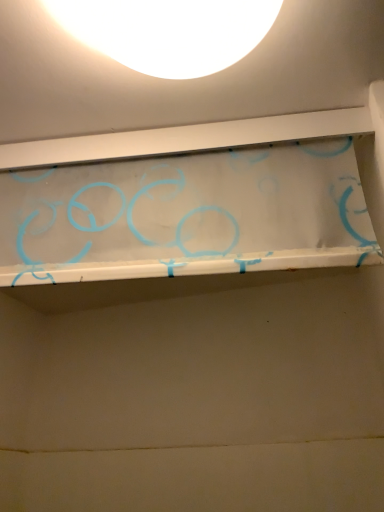
The height and width of the screenshot is (512, 384). What do you see at coordinates (168, 32) in the screenshot? I see `white matte lampshade at upper center` at bounding box center [168, 32].

I want to click on white matte lampshade at upper center, so tap(168, 32).

This screenshot has height=512, width=384. Identify the location of transparent plastic shelf at upper center. (198, 207).

Describe the element at coordinates (198, 207) in the screenshot. I see `transparent plastic shelf at upper center` at that location.

You are a GUI agent. You are given a task and a screenshot of the screen. Output one action in this format:
    pyautogui.click(x=<x>, y=<y>)
    Task: Click on the white matte lampshade at upper center
    The image size is (384, 512).
    Given the screenshot: What is the action you would take?
    pyautogui.click(x=168, y=32)

Can you confirm if white matte lampshade at upper center is positioned to the right of transparent plastic shelf at upper center?

Yes.

Is white matte lampshade at upper center further to camera compared to transparent plastic shelf at upper center?

That is False.

Which point is more distant from viewer, [250,48] or [293,199]?

The point [293,199] is behind.

From the image's perspective, is white matte lampshade at upper center above transparent plastic shelf at upper center?

Yes.

From a real-world perspective, is white matte lampshade at upper center positioned above or below transparent plastic shelf at upper center?

From a real-world perspective, white matte lampshade at upper center is physically above transparent plastic shelf at upper center.

Can you confirm if white matte lampshade at upper center is wider than transparent plastic shelf at upper center?

Indeed, white matte lampshade at upper center has a greater width compared to transparent plastic shelf at upper center.

Is white matte lampshade at upper center shorter than transparent plastic shelf at upper center?

Indeed, white matte lampshade at upper center has a lesser height compared to transparent plastic shelf at upper center.

Considering the relative sizes of white matte lampshade at upper center and transparent plastic shelf at upper center in the image provided, is white matte lampshade at upper center smaller than transparent plastic shelf at upper center?

Yes.

Can transparent plastic shelf at upper center be found inside white matte lampshade at upper center?

Actually, transparent plastic shelf at upper center is outside white matte lampshade at upper center.

Is white matte lampshade at upper center far away from transparent plastic shelf at upper center?

No.

Could you tell me if white matte lampshade at upper center is facing transparent plastic shelf at upper center?

No, white matte lampshade at upper center is not facing towards transparent plastic shelf at upper center.

How many degrees apart are the facing directions of white matte lampshade at upper center and transparent plastic shelf at upper center?

The facing directions of white matte lampshade at upper center and transparent plastic shelf at upper center are 82.9 degrees apart.

Could you measure the distance between white matte lampshade at upper center and transparent plastic shelf at upper center?

They are 8.89 inches apart.

Image resolution: width=384 pixels, height=512 pixels. I want to click on shelf located below the white matte lampshade at upper center (from the image's perspective), so click(x=198, y=207).

Visually, is transparent plastic shelf at upper center positioned to the left or to the right of white matte lampshade at upper center?

transparent plastic shelf at upper center is to the left of white matte lampshade at upper center.

Considering the positions of objects transparent plastic shelf at upper center and white matte lampshade at upper center in the image provided, who is behind, transparent plastic shelf at upper center or white matte lampshade at upper center?

Positioned behind is transparent plastic shelf at upper center.

Which point is more forward, (195, 252) or (244, 10)?

The point (244, 10) is more forward.

From the image's perspective, which object appears higher, transparent plastic shelf at upper center or white matte lampshade at upper center?

white matte lampshade at upper center is shown above in the image.

From a real-world perspective, is transparent plastic shelf at upper center on white matte lampshade at upper center?

No.

Does transparent plastic shelf at upper center have a lesser width compared to white matte lampshade at upper center?

Yes.

Is transparent plastic shelf at upper center taller than white matte lampshade at upper center?

Indeed, transparent plastic shelf at upper center has a greater height compared to white matte lampshade at upper center.

In the scene shown: Can you confirm if transparent plastic shelf at upper center is bigger than white matte lampshade at upper center?

Correct, transparent plastic shelf at upper center is larger in size than white matte lampshade at upper center.

Is transparent plastic shelf at upper center positioned beyond the bounds of white matte lampshade at upper center?

Indeed, transparent plastic shelf at upper center is completely outside white matte lampshade at upper center.

Is there a large distance between transparent plastic shelf at upper center and white matte lampshade at upper center?

No, transparent plastic shelf at upper center is in close proximity to white matte lampshade at upper center.

Is transparent plastic shelf at upper center oriented away from white matte lampshade at upper center?

No, transparent plastic shelf at upper center's orientation is not away from white matte lampshade at upper center.

Looking at this image, what's the angular difference between transparent plastic shelf at upper center and white matte lampshade at upper center's facing directions?

They differ by 82.9 degrees in their facing directions.

How much distance is there between transparent plastic shelf at upper center and white matte lampshade at upper center?

8.89 inches.

The width and height of the screenshot is (384, 512). I want to click on shelf below the white matte lampshade at upper center (from the image's perspective), so click(198, 207).

Locate an element on the screen. shelf on the left of white matte lampshade at upper center is located at coordinates (198, 207).

Identify the location of shelf lying below the white matte lampshade at upper center (from the image's perspective). The height and width of the screenshot is (512, 384). (198, 207).